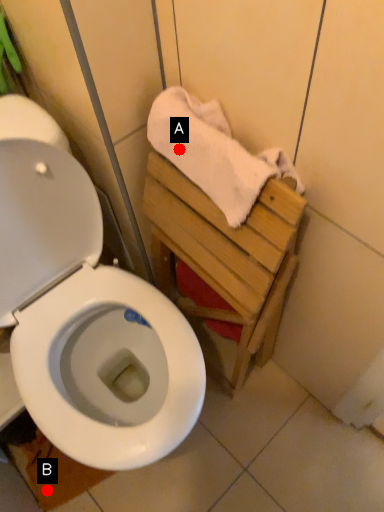
Question: Two points are circled on the image, labeled by A and B beside each circle. Which point is closer to the camera?

Choices:
 (A) A is closer
 (B) B is closer

Answer: (A)